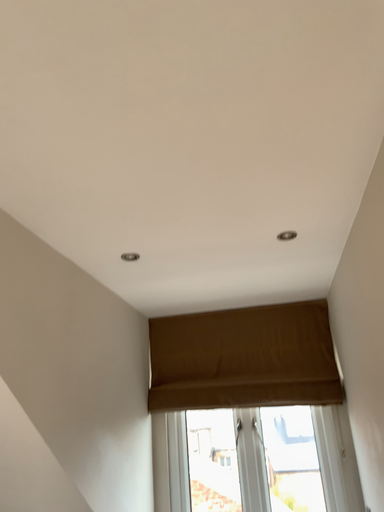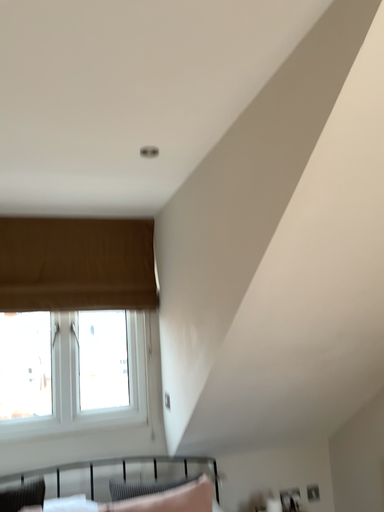
Question: Which way did the camera rotate in the video?

Choices:
 (A) rotated upward
 (B) rotated downward

Answer: (B)